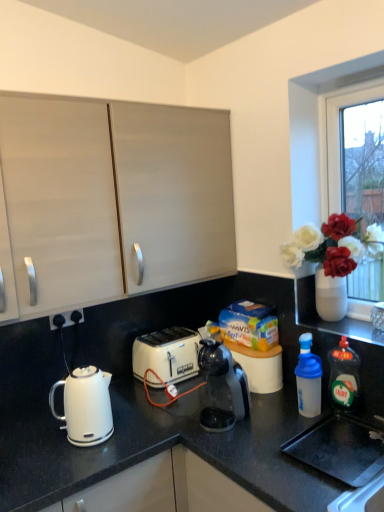
The width and height of the screenshot is (384, 512). I want to click on blank space situated above white plastic toaster at center (from a real-world perspective), so click(x=158, y=337).